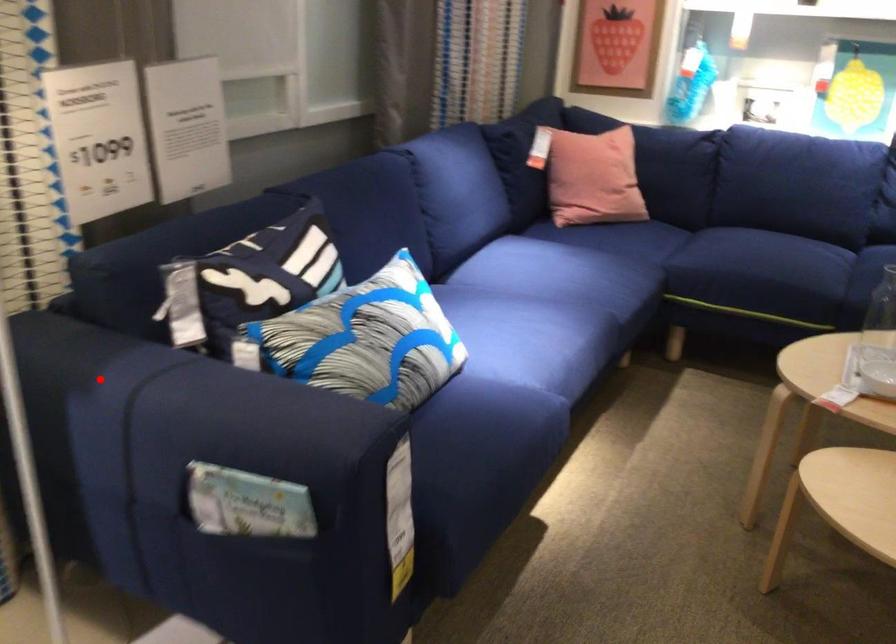
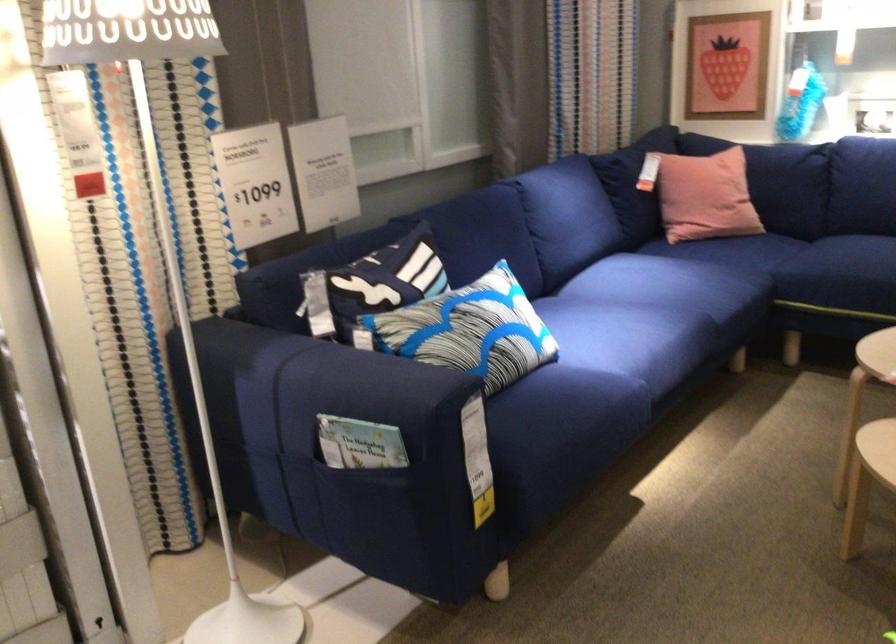
Question: I am providing you with two images of the same scene from different viewpoints. A red point is shown in image1. For the corresponding object point in image2, is it positioned nearer or farther from the camera?

Choices:
 (A) Nearer
 (B) Farther

Answer: (B)